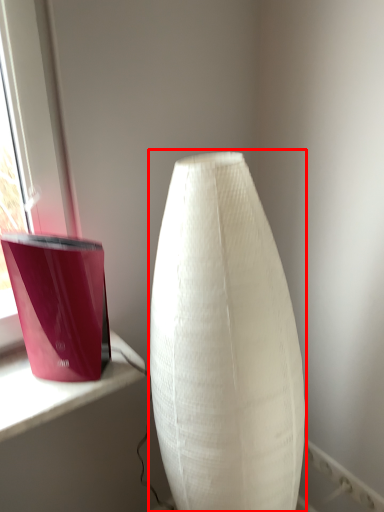
Question: From the image's perspective, what is the correct spatial positioning of lamp (annotated by the red box) in reference to candle holder?

Choices:
 (A) below
 (B) above

Answer: (A)